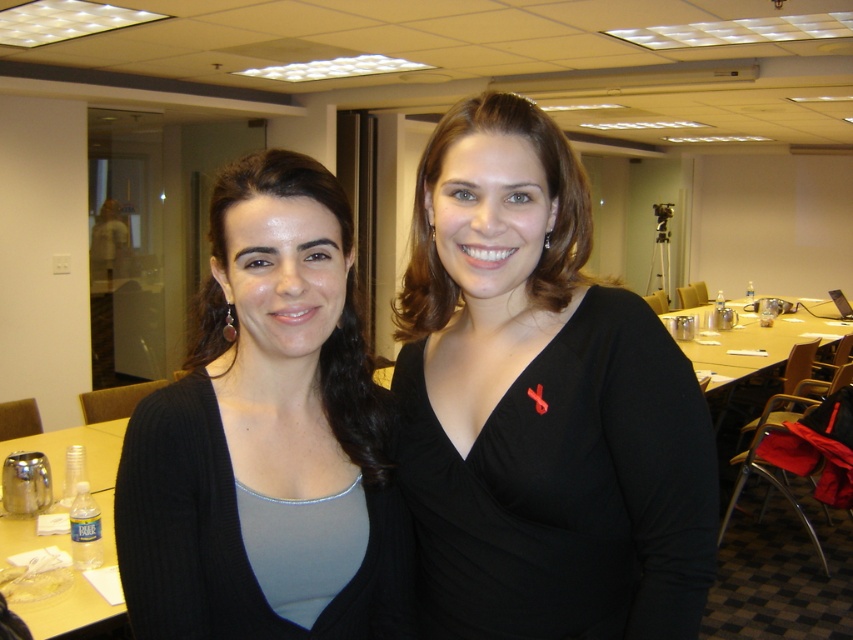
You are organizing a small event and need to place a matte black cardigan at center and a clear plastic water bottle at lower left on a shelf. Which item will take up more space on the shelf?

The clear plastic water bottle at lower left occupies more space than the matte black cardigan at center, so it will take up more space on the shelf.

You are standing in the conference room and see the point marked at coordinates (540, 404). Which object is this point located on?

The point marked at coordinates (540, 404) is located on the black matte dress at center.